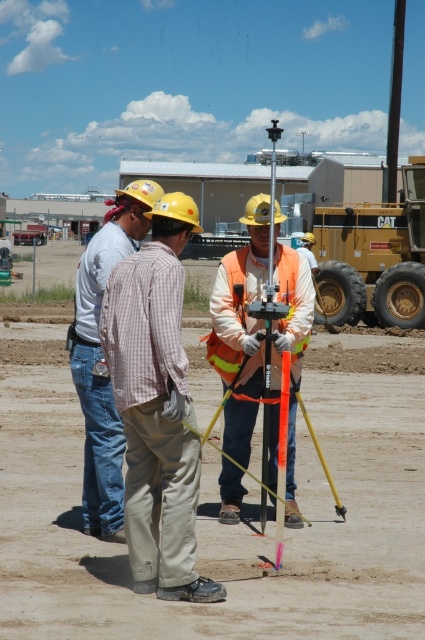
Question: Is dirt at center smaller than hi-visibility orange safety vest at center?

Choices:
 (A) yes
 (B) no

Answer: (B)

Question: Is denim jeans at left closer to the viewer compared to hi-visibility orange safety vest at center?

Choices:
 (A) yes
 (B) no

Answer: (A)

Question: Is denim jeans at left to the right of hi-visibility orange safety vest at center from the viewer's perspective?

Choices:
 (A) no
 (B) yes

Answer: (A)

Question: Which object is the closest to the metallic silver pole at center?

Choices:
 (A) plaid cotton shirt at center
 (B) hi-visibility orange safety vest at center

Answer: (A)

Question: Which point is farther to the camera?

Choices:
 (A) reflective orange vest at center
 (B) dirt at center
 (C) plaid cotton shirt at center
 (D) denim jeans at left

Answer: (A)

Question: Which point is closer to the camera?

Choices:
 (A) (255, 356)
 (B) (231, 257)

Answer: (A)